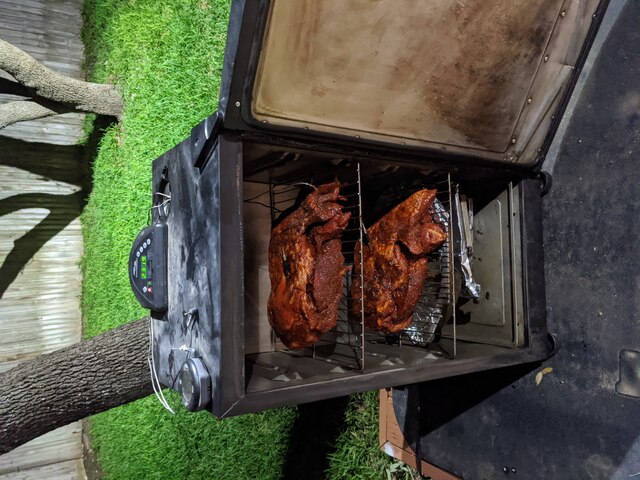
The height and width of the screenshot is (480, 640). In order to click on door hinge in this screenshot , I will do `click(481, 160)`.